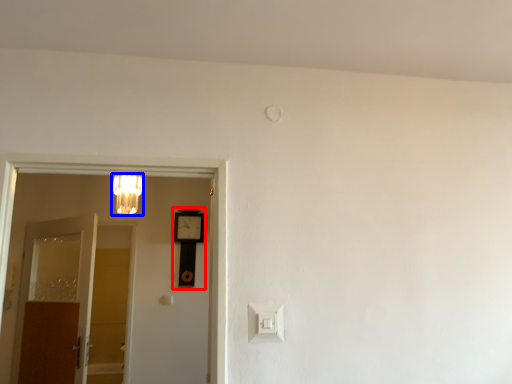
Question: Which of the following is the closest to the observer, clock (highlighted by a red box) or light fixture (highlighted by a blue box)?

Choices:
 (A) clock
 (B) light fixture

Answer: (B)